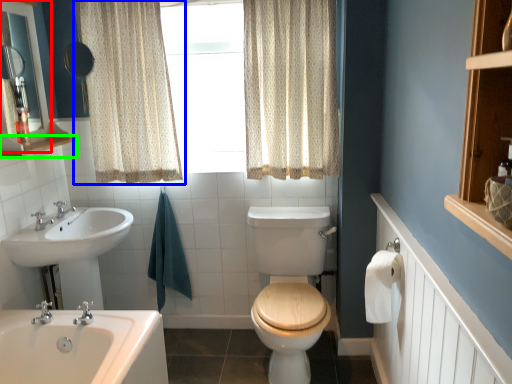
Question: Which object is the farthest from medicine cabinet (highlighted by a red box)? Choose among these: curtain (highlighted by a blue box) or balustrade (highlighted by a green box).

Choices:
 (A) curtain
 (B) balustrade

Answer: (A)